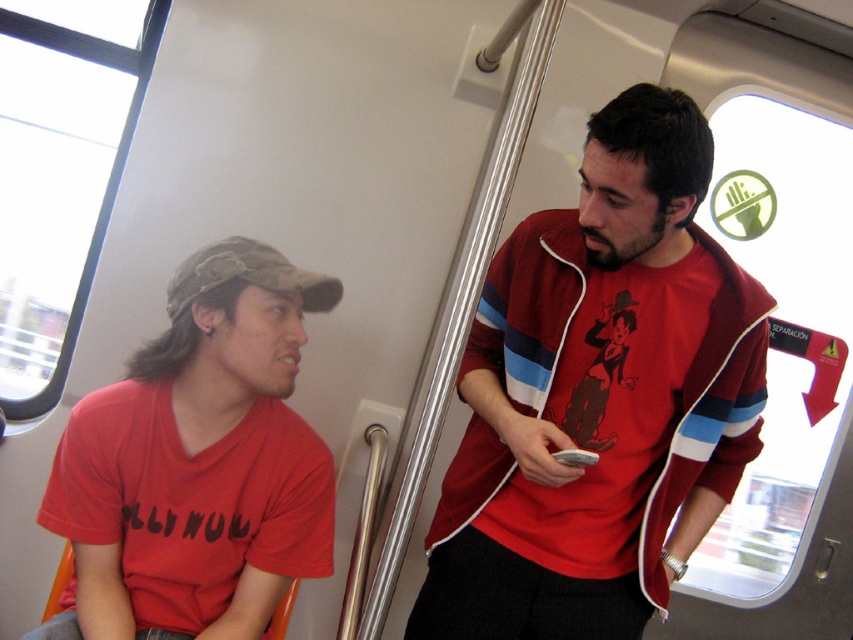
You are standing at the camera position and want to reach the point marked as point (659, 97). Can you walk directly to it without moving around any obstacles?

The point (659, 97) is 4.39 feet away from the camera, so yes, you can walk directly to it without needing to move around any obstacles as there is no mention of obstacles in the scene description.